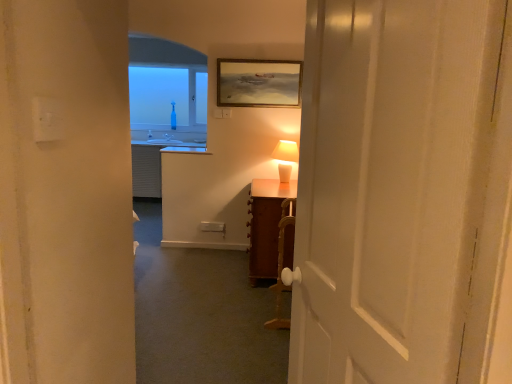
At what (x,y) coordinates should I click in order to perform the action: click on vacant point above gold-framed painting at upper center (from a real-world perspective). Please return your answer as a coordinate pair (x, y). Image resolution: width=512 pixels, height=384 pixels. Looking at the image, I should click on (x=257, y=51).